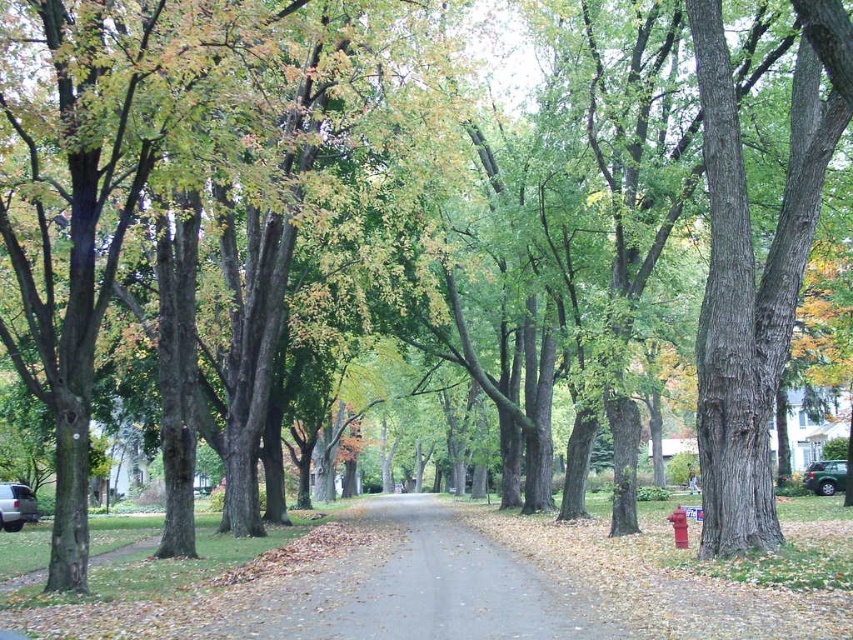
Is point (323, 611) farther from camera compared to point (677, 512)?

No, it is not.

This screenshot has width=853, height=640. Describe the element at coordinates (421, 588) in the screenshot. I see `brown gravel alley at center` at that location.

Locate an element on the screen. brown gravel alley at center is located at coordinates (421, 588).

Which is more to the left, silver metallic suv at left or green matte car at lower right?

Positioned to the left is silver metallic suv at left.

Is silver metallic suv at left bigger than green matte car at lower right?

Yes.

Between point (15, 509) and point (817, 476), which one is positioned in front?

Point (15, 509) is in front.

Where is `silver metallic suv at left`? This screenshot has width=853, height=640. silver metallic suv at left is located at coordinates (16, 506).

Between brown gravel alley at center and silver metallic suv at left, which one appears on the left side from the viewer's perspective?

From the viewer's perspective, silver metallic suv at left appears more on the left side.

Does brown gravel alley at center have a greater width compared to silver metallic suv at left?

Indeed, brown gravel alley at center has a greater width compared to silver metallic suv at left.

Where is `brown gravel alley at center`? This screenshot has height=640, width=853. brown gravel alley at center is located at coordinates (421, 588).